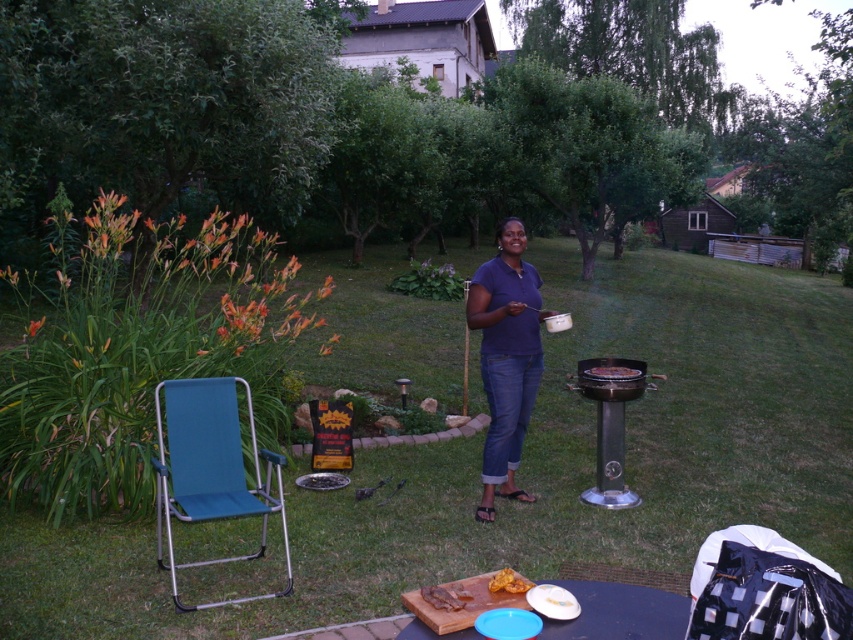
This screenshot has width=853, height=640. Describe the element at coordinates (610, 424) in the screenshot. I see `stainless steel barbecue grill at center right` at that location.

Who is lower down, stainless steel barbecue grill at center right or yellow matte bread at center?

yellow matte bread at center is below.

This screenshot has width=853, height=640. What do you see at coordinates (610, 424) in the screenshot?
I see `stainless steel barbecue grill at center right` at bounding box center [610, 424].

I want to click on stainless steel barbecue grill at center right, so click(610, 424).

Between point (601, 360) and point (560, 595), which one is positioned behind?

The point (601, 360) is more distant.

The width and height of the screenshot is (853, 640). Describe the element at coordinates (610, 424) in the screenshot. I see `stainless steel barbecue grill at center right` at that location.

The image size is (853, 640). I want to click on stainless steel barbecue grill at center right, so pos(610,424).

Which is more to the left, brown crispy meat at center or golden crispy bread at center?

brown crispy meat at center is more to the left.

Is brown crispy meat at center wider than golden crispy bread at center?

Correct, the width of brown crispy meat at center exceeds that of golden crispy bread at center.

Does point (457, 596) come behind point (567, 602)?

Yes.

Find the location of `brown crispy meat at center`. brown crispy meat at center is located at coordinates (444, 596).